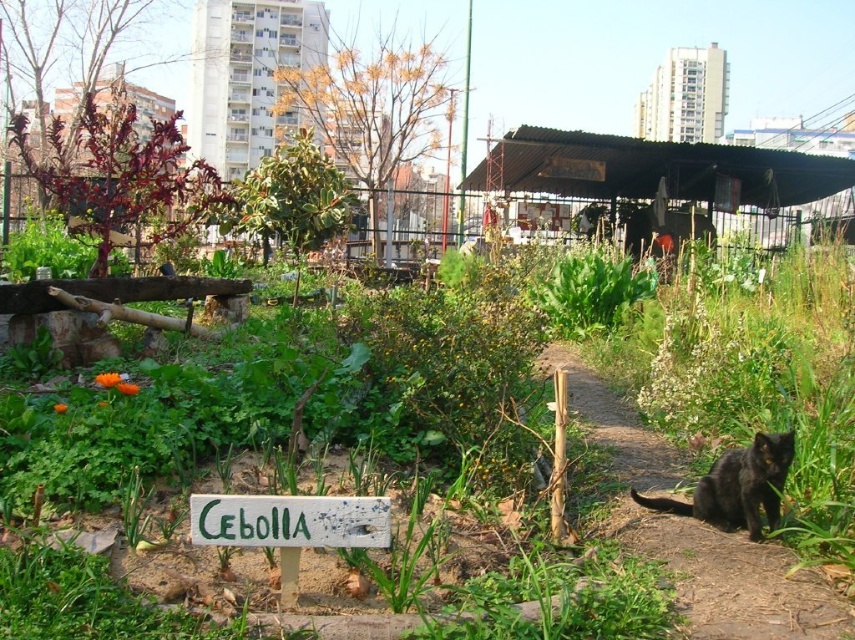
You are a gardener holding a 36 inch long garden hose. You want to water the green painted wood sign at center from the black fur cat at lower right. Can you reach the sign with the hose without moving?

The distance between the green painted wood sign at center and the black fur cat at lower right is 38.18 inches. Since the hose is 36 inches long, it is slightly shorter than the distance required. You would need to move closer or use a longer hose to reach the sign.

You are a gardener who wants to place a new plant pot between the dirt path at center and the green painted wood sign at center. Based on their positions, which object should the plant pot be closer to?

The dirt path at center is to the right of green painted wood sign at center, so the plant pot should be placed closer to the green painted wood sign at center to be between them.

You are a gardener who needs to place a 1 meter long wooden plank between the dirt path at center and the green painted wood sign at center. Is there enough space to place it horizontally between them?

The dirt path at center is 93.27 centimeters from green painted wood sign at center. Since the plank is 1 meter long, which is longer than the distance between them, it cannot be placed horizontally between the dirt path at center and the green painted wood sign at center.